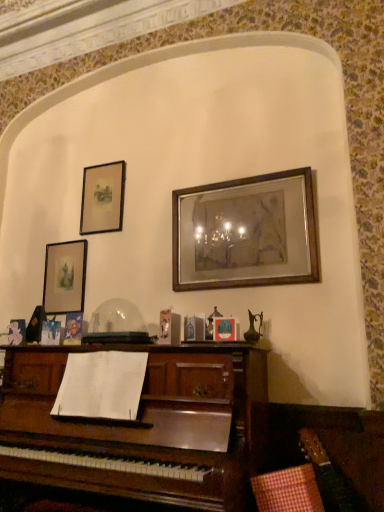
Question: Based on their sizes in the image, would you say matte gold picture frame at upper left, positioned as the 3th picture frame in right-to-left order, is bigger or smaller than wooden picture frame at center, placed as the 3th picture frame when sorted from left to right?

Choices:
 (A) small
 (B) big

Answer: (A)

Question: From a real-world perspective, is matte gold picture frame at upper left, positioned as the 3th picture frame in right-to-left order, physically located above or below wooden picture frame at center, placed as the 3th picture frame when sorted from left to right?

Choices:
 (A) above
 (B) below

Answer: (B)

Question: Which of these objects is positioned closest to the matte black picture frame at upper left, which ranks as the second picture frame in right-to-left order?

Choices:
 (A) matte gold picture frame at upper left, positioned as the first picture frame in left-to-right order
 (B) wooden picture frame at center, placed as the 3th picture frame when sorted from left to right

Answer: (A)

Question: Which object is positioned farthest from the matte gold picture frame at upper left, positioned as the 3th picture frame in right-to-left order?

Choices:
 (A) matte black picture frame at upper left, which ranks as the second picture frame in right-to-left order
 (B) wooden picture frame at center, placed as the 3th picture frame when sorted from left to right

Answer: (B)